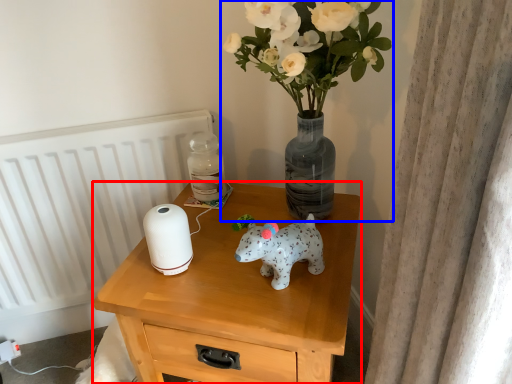
Question: Among these objects, which one is nearest to the camera, nightstand (highlighted by a red box) or houseplant (highlighted by a blue box)?

Choices:
 (A) nightstand
 (B) houseplant

Answer: (B)